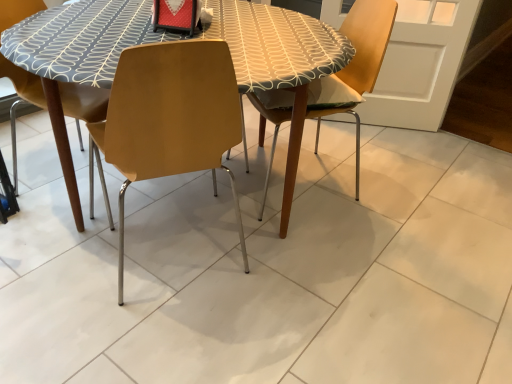
Identify the location of vacant area that is in front of matte wood chair at center, acting as the 1th chair starting from the left. The height and width of the screenshot is (384, 512). (146, 328).